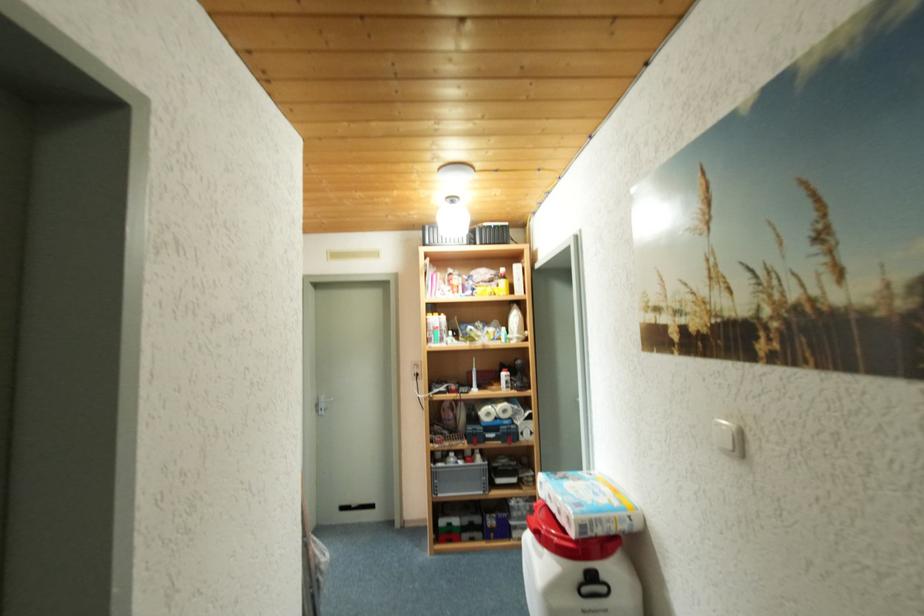
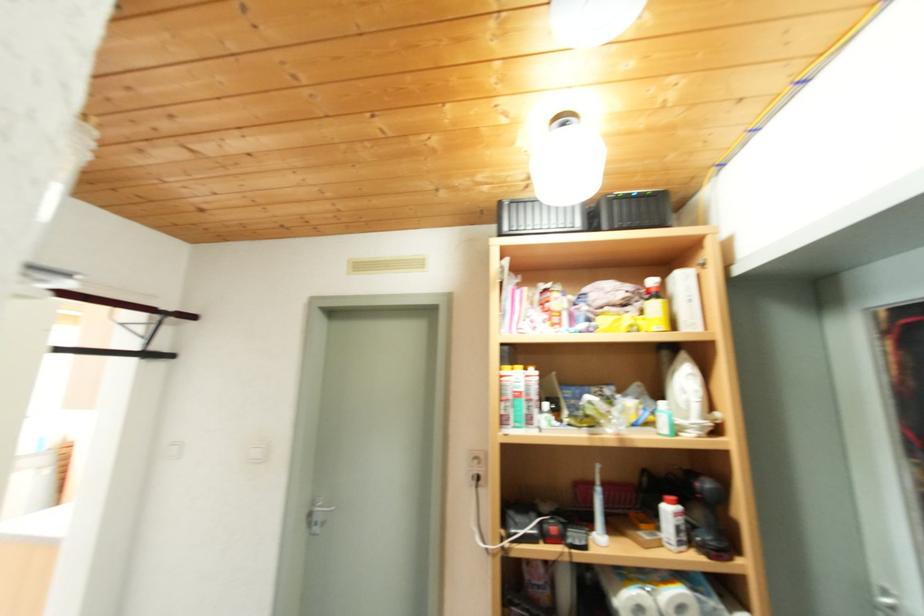
Question: In a continuous first-person perspective shot, in which direction is the camera moving?

Choices:
 (A) Left
 (B) Right
 (C) Forward
 (D) Backward

Answer: (C)